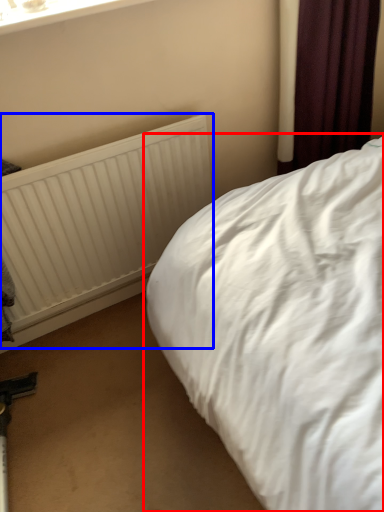
Question: Which object appears closest to the camera in this image, bed (highlighted by a red box) or radiator (highlighted by a blue box)?

Choices:
 (A) bed
 (B) radiator

Answer: (A)